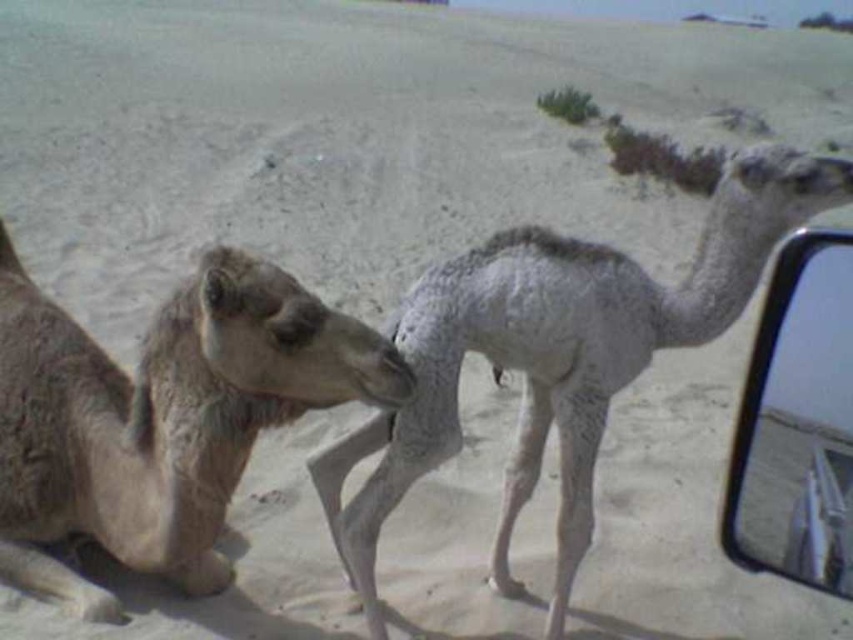
Question: Which point is farther to the camera?

Choices:
 (A) [91, 445]
 (B) [810, 157]
 (C) [828, 378]

Answer: (A)

Question: Does gray speckled camel at right have a greater width compared to transparent plastic mirror at right?

Choices:
 (A) no
 (B) yes

Answer: (B)

Question: Which object is farther from the camera taking this photo?

Choices:
 (A) gray speckled camel at right
 (B) transparent plastic mirror at right
 (C) desert tan camel at left

Answer: (C)

Question: Can you confirm if desert tan camel at left is wider than transparent plastic mirror at right?

Choices:
 (A) yes
 (B) no

Answer: (A)

Question: Considering the relative positions of gray speckled camel at right and transparent plastic mirror at right in the image provided, where is gray speckled camel at right located with respect to transparent plastic mirror at right?

Choices:
 (A) left
 (B) right

Answer: (A)

Question: Which point is closer to the camera taking this photo?

Choices:
 (A) (560, 349)
 (B) (833, 349)
 (C) (254, 355)

Answer: (B)